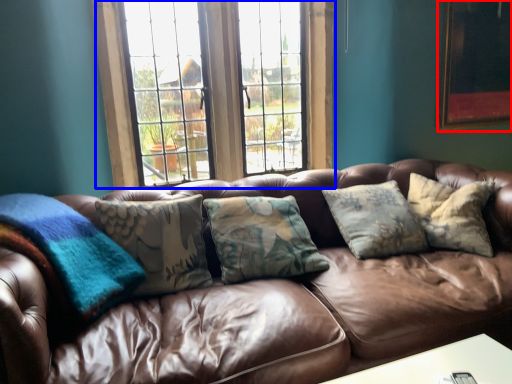
Question: Among these objects, which one is nearest to the camera, picture frame (highlighted by a red box) or window (highlighted by a blue box)?

Choices:
 (A) picture frame
 (B) window

Answer: (B)